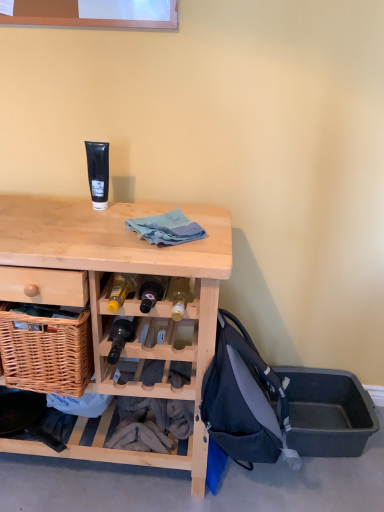
The height and width of the screenshot is (512, 384). What are the coordinates of `vacant space to the right of blue cotton cloth at center` in the screenshot? It's located at (215, 230).